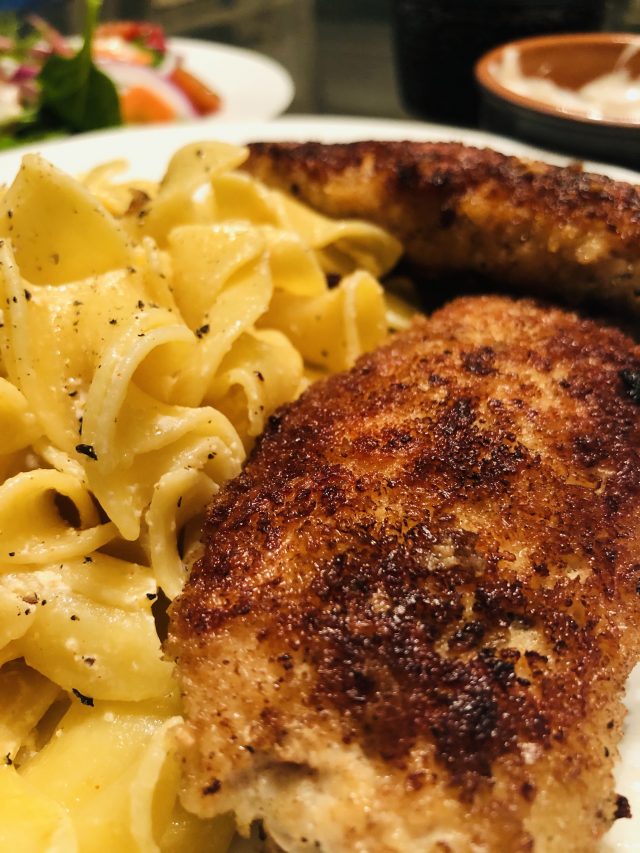
At what (x,y) coordinates should I click in order to perform the action: click on dishes. Please return your answer as a coordinate pair (x, y). This screenshot has width=640, height=853. Looking at the image, I should click on (152, 148), (246, 95), (582, 47).